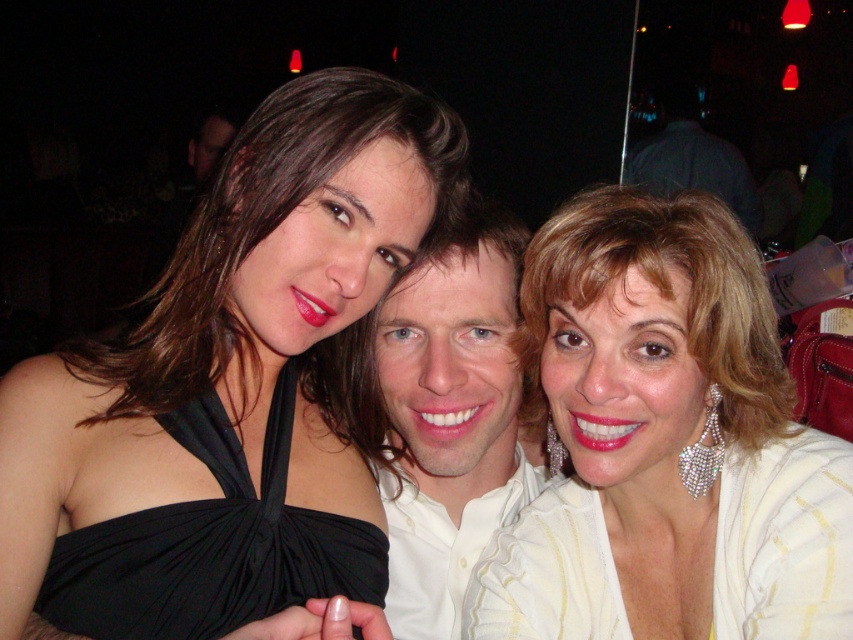
Question: Can you confirm if black satin dress at center is positioned to the left of black satin dress at left?

Choices:
 (A) yes
 (B) no

Answer: (B)

Question: Which point appears farthest from the camera in this image?

Choices:
 (A) (485, 346)
 (B) (614, 292)

Answer: (A)

Question: Observing the image, what is the correct spatial positioning of white smooth shirt at center in reference to black satin dress at left?

Choices:
 (A) left
 (B) right

Answer: (B)

Question: Which point is farther to the camera?

Choices:
 (A) (421, 468)
 (B) (219, 464)
 (C) (173, 552)

Answer: (A)

Question: Does white satin blouse at right appear over black satin dress at left?

Choices:
 (A) no
 (B) yes

Answer: (B)

Question: Estimate the real-world distances between objects in this image. Which object is closer to the white satin blouse at right?

Choices:
 (A) shiny silver earrings at upper right
 (B) black satin dress at center
 (C) black satin dress at left
 (D) white smooth shirt at center

Answer: (A)